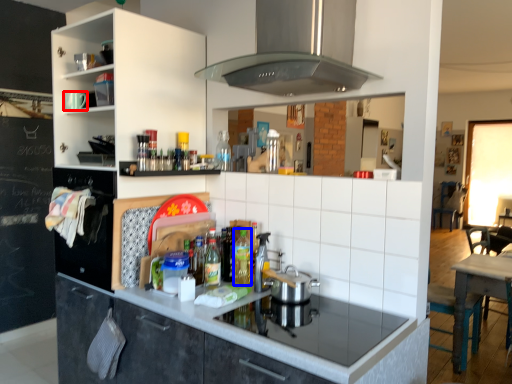
Question: Which point is closer to the camera, appliance (highlighted by a red box) or bottle (highlighted by a blue box)?

Choices:
 (A) appliance
 (B) bottle

Answer: (B)